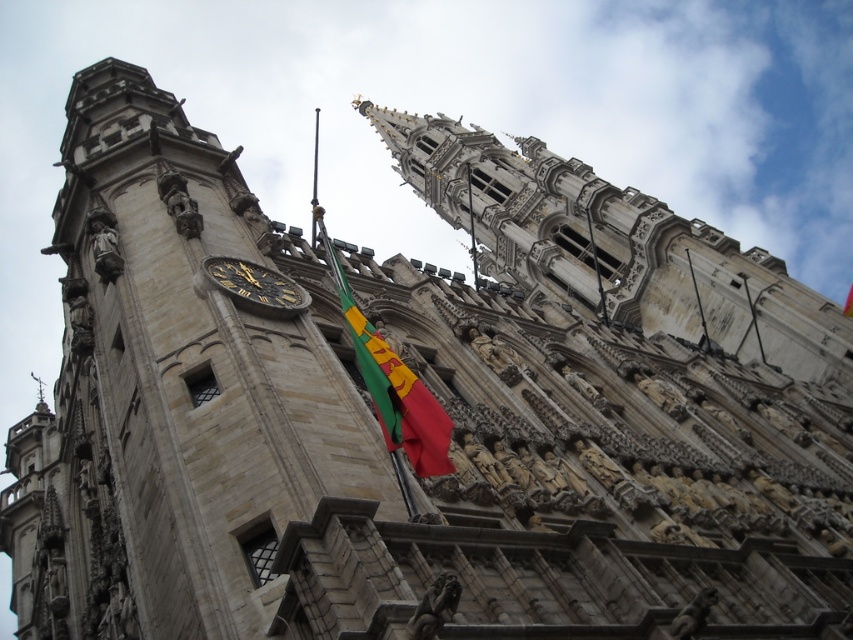
You are standing in front of the historic building and notice two elements at the center of the image. The green fabric flag at center and the dark brown stone clock at center. Which one is taller?

The green fabric flag at center is taller than the dark brown stone clock at center.

You are standing in front of the historic building and notice the green fabric flag at center and the dark brown stone clock at center. Which object is positioned to the right of the other?

The green fabric flag at center is to the right of the dark brown stone clock at center.